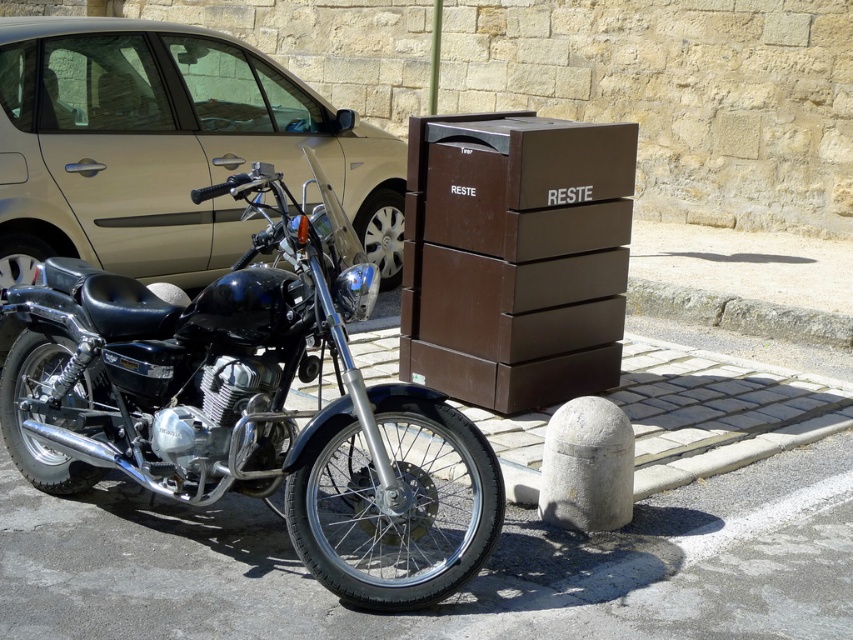
You are a delivery person trying to park your van in the space between the metallic gold car at left and the brown matte trash bin at center. Can you safely maneuver your van into this space without hitting either object?

The brown matte trash bin at center is behind the metallic gold car at left, so there is no space between them for the van to maneuver. Therefore, the van cannot safely park between them.

You are a delivery person who needs to park your delivery van next to the metallic gold car at left and the brown matte trash bin at center. Can you park your van between them without overlapping either?

The metallic gold car at left is bigger than the brown matte trash bin at center. Therefore, there is sufficient space between them to park the delivery van without overlapping either object.

You are a delivery person who needs to load a large package onto a cart. The cart can only handle items that are shorter than the shiny black motorcycle at left. Can you safely place the package on the cart if it is as tall as the metallic gold car at left?

The shiny black motorcycle at left has a lesser height compared to metallic gold car at left. Since the package is as tall as the metallic gold car at left, it would exceed the cart height limit. Therefore, you cannot safely place the package on the cart.